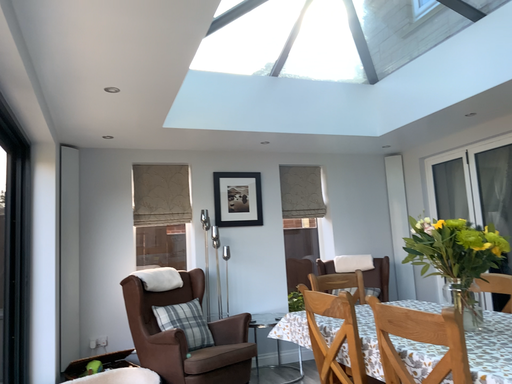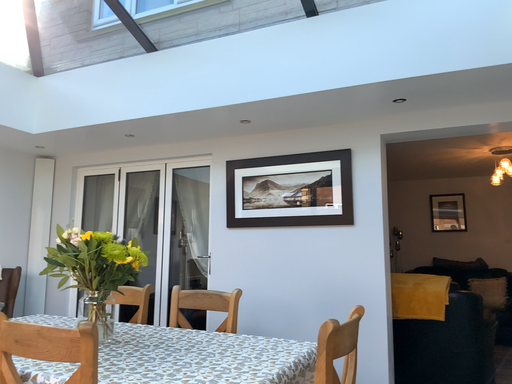
Question: Which way did the camera rotate in the video?

Choices:
 (A) rotated left
 (B) rotated right

Answer: (B)